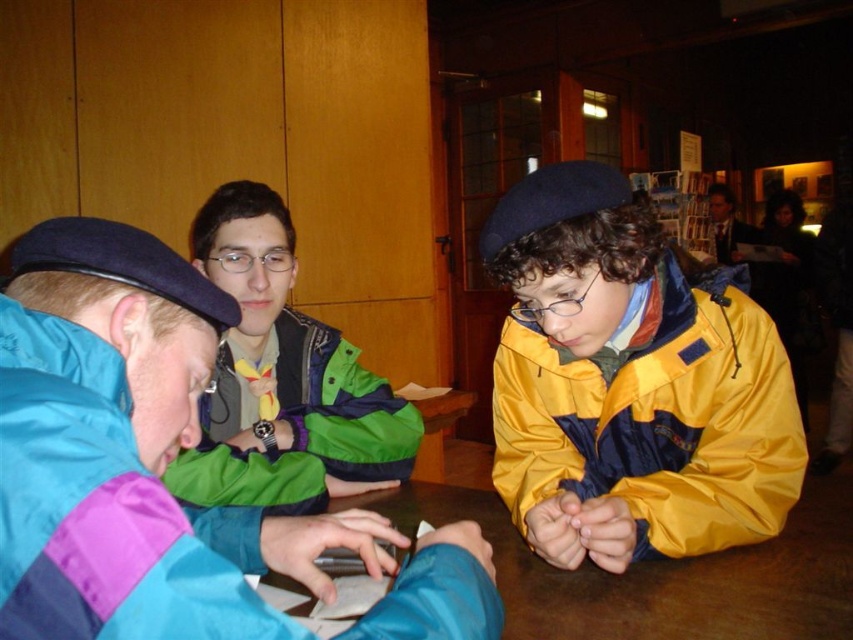
Who is shorter, yellow matte jacket at center or green matte jacket at center?

Standing shorter between the two is green matte jacket at center.

Does point (746, 397) come in front of point (200, 456)?

Yes, it is.

You are a GUI agent. You are given a task and a screenshot of the screen. Output one action in this format:
    pyautogui.click(x=<x>, y=<y>)
    Task: Click on the yellow matte jacket at center
    
    Given the screenshot: What is the action you would take?
    pyautogui.click(x=648, y=426)

Who is positioned more to the right, matte blue jacket at left or brown wooden table at center?

From the viewer's perspective, brown wooden table at center appears more on the right side.

Does matte blue jacket at left have a lesser width compared to brown wooden table at center?

Yes, matte blue jacket at left is thinner than brown wooden table at center.

Is point (15, 412) positioned in front of point (733, 608)?

Yes, point (15, 412) is in front of point (733, 608).

Image resolution: width=853 pixels, height=640 pixels. Identify the location of matte blue jacket at left. (129, 452).

Can you confirm if green matte jacket at center is wider than formal suit at upper right?

Incorrect, green matte jacket at center's width does not surpass formal suit at upper right's.

In the scene shown: Which is below, green matte jacket at center or formal suit at upper right?

green matte jacket at center is lower down.

I want to click on green matte jacket at center, so click(296, 426).